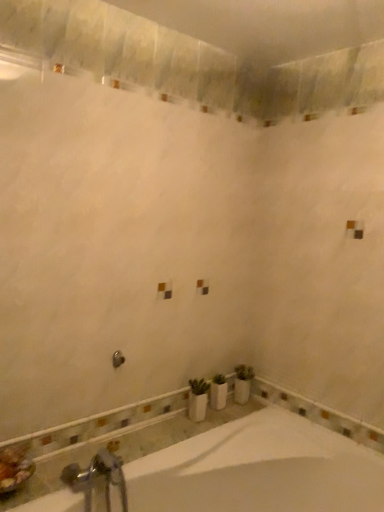
Based on the photo, what is the approximate width of white ceramic vase at lower center?

white ceramic vase at lower center is 4.75 inches wide.

The image size is (384, 512). I want to click on silver metallic faucet at lower left, so click(97, 479).

Which object is positioned more to the left, silver metallic faucet at lower left or brushed metal shower at center?

silver metallic faucet at lower left.

Is silver metallic faucet at lower left facing away from brushed metal shower at center?

No, silver metallic faucet at lower left is not facing away from brushed metal shower at center.

Does silver metallic faucet at lower left have a lesser height compared to brushed metal shower at center?

No, silver metallic faucet at lower left is not shorter than brushed metal shower at center.

Who is more distant, silver metallic faucet at lower left or brushed metal shower at center?

brushed metal shower at center is behind.

Is white ceramic vase at lower center outside of brushed metal shower at center?

Indeed, white ceramic vase at lower center is completely outside brushed metal shower at center.

Considering the points (246, 373) and (113, 359), which point is behind, point (246, 373) or point (113, 359)?

Point (246, 373)

Where is `plant lying above the white glossy bathtub at lower center (from the image's perspective)`? Image resolution: width=384 pixels, height=512 pixels. plant lying above the white glossy bathtub at lower center (from the image's perspective) is located at coordinates (243, 383).

Considering the relative positions of white glossy bathtub at lower center and white ceramic vase at lower center in the image provided, is white glossy bathtub at lower center to the left or to the right of white ceramic vase at lower center?

Clearly, white glossy bathtub at lower center is on the left of white ceramic vase at lower center in the image.

Which object is more forward, white glossy bathtub at lower center or white ceramic vase at lower center?

white glossy bathtub at lower center is closer to the camera.

Are brushed metal shower at center and silver metallic faucet at lower left far apart?

They are positioned close to each other.

From a real-world perspective, is brushed metal shower at center on top of silver metallic faucet at lower left?

Indeed, from a real-world perspective, brushed metal shower at center stands above silver metallic faucet at lower left.

How far apart are brushed metal shower at center and silver metallic faucet at lower left?

18.43 inches.

From the image's perspective, is brushed metal shower at center on top of silver metallic faucet at lower left?

Yes.

Who is bigger, brushed metal shower at center or white glossy bathtub at lower center?

Answer: white glossy bathtub at lower center.

Is the position of brushed metal shower at center more distant than that of white glossy bathtub at lower center?

Yes, the depth of brushed metal shower at center is greater than that of white glossy bathtub at lower center.

Can you confirm if brushed metal shower at center is thinner than white glossy bathtub at lower center?

Correct, the width of brushed metal shower at center is less than that of white glossy bathtub at lower center.

Is brushed metal shower at center far away from white glossy bathtub at lower center?

brushed metal shower at center is actually quite close to white glossy bathtub at lower center.

At what (x,y) coordinates should I click in order to perform the action: click on plant above the silver metallic faucet at lower left (from the image's perspective). Please return your answer as a coordinate pair (x, y). Image resolution: width=384 pixels, height=512 pixels. Looking at the image, I should click on (243, 383).

Considering the sizes of objects silver metallic faucet at lower left and white ceramic vase at lower center in the image provided, who is wider, silver metallic faucet at lower left or white ceramic vase at lower center?

With larger width is silver metallic faucet at lower left.

From a real-world perspective, is silver metallic faucet at lower left physically located above or below white ceramic vase at lower center?

silver metallic faucet at lower left is situated lower than white ceramic vase at lower center in the real world.

From the image's perspective, is silver metallic faucet at lower left positioned above or below white ceramic vase at lower center?

Clearly, from the image's perspective, silver metallic faucet at lower left is below white ceramic vase at lower center.

Consider the image. Which of these two, white glossy bathtub at lower center or silver metallic faucet at lower left, stands taller?

With more height is white glossy bathtub at lower center.

From the image's perspective, would you say white glossy bathtub at lower center is positioned over silver metallic faucet at lower left?

No.

Between white glossy bathtub at lower center and silver metallic faucet at lower left, which one appears on the left side from the viewer's perspective?

From the viewer's perspective, silver metallic faucet at lower left appears more on the left side.

Are white glossy bathtub at lower center and silver metallic faucet at lower left located far from each other?

A: Actually, white glossy bathtub at lower center and silver metallic faucet at lower left are a little close together.

Locate an element on the screen. tap below the brushed metal shower at center (from the image's perspective) is located at coordinates (97, 479).

Identify the location of shower in front of the white ceramic vase at lower center. click(118, 359).

Based on their spatial positions, is silver metallic faucet at lower left or brushed metal shower at center closer to white ceramic vase at lower center?

brushed metal shower at center.

Estimate the real-world distances between objects in this image. Which object is closer to silver metallic faucet at lower left, white glossy bathtub at lower center or brushed metal shower at center?

white glossy bathtub at lower center is positioned closer to the anchor silver metallic faucet at lower left.

Which object lies further to the anchor point silver metallic faucet at lower left, white ceramic vase at lower center or white glossy bathtub at lower center?

Among the two, white ceramic vase at lower center is located further to silver metallic faucet at lower left.

When comparing their distances from white ceramic vase at lower center, does white glossy bathtub at lower center or brushed metal shower at center seem closer?

white glossy bathtub at lower center.

Looking at the image, which one is located closer to brushed metal shower at center, white glossy bathtub at lower center or silver metallic faucet at lower left?

The object closer to brushed metal shower at center is silver metallic faucet at lower left.

Consider the image. When comparing their distances from white ceramic vase at lower center, does white glossy bathtub at lower center or silver metallic faucet at lower left seem further?

The object further to white ceramic vase at lower center is silver metallic faucet at lower left.

From the image, which object appears to be farther from brushed metal shower at center, white ceramic vase at lower center or white glossy bathtub at lower center?

white glossy bathtub at lower center is positioned further to the anchor brushed metal shower at center.

Considering their positions, is silver metallic faucet at lower left positioned further to brushed metal shower at center than white glossy bathtub at lower center?

Among the two, white glossy bathtub at lower center is located further to brushed metal shower at center.

At what (x,y) coordinates should I click in order to perform the action: click on tap between white glossy bathtub at lower center and white ceramic vase at lower center along the z-axis. Please return your answer as a coordinate pair (x, y). Image resolution: width=384 pixels, height=512 pixels. Looking at the image, I should click on (97, 479).

Locate an element on the screen. tap positioned between white glossy bathtub at lower center and brushed metal shower at center from near to far is located at coordinates (97, 479).

Where is `shower positioned between silver metallic faucet at lower left and white ceramic vase at lower center from near to far`? shower positioned between silver metallic faucet at lower left and white ceramic vase at lower center from near to far is located at coordinates (x=118, y=359).

The image size is (384, 512). In order to click on shower between white glossy bathtub at lower center and white ceramic vase at lower center in the front-back direction in this screenshot , I will do `click(118, 359)`.